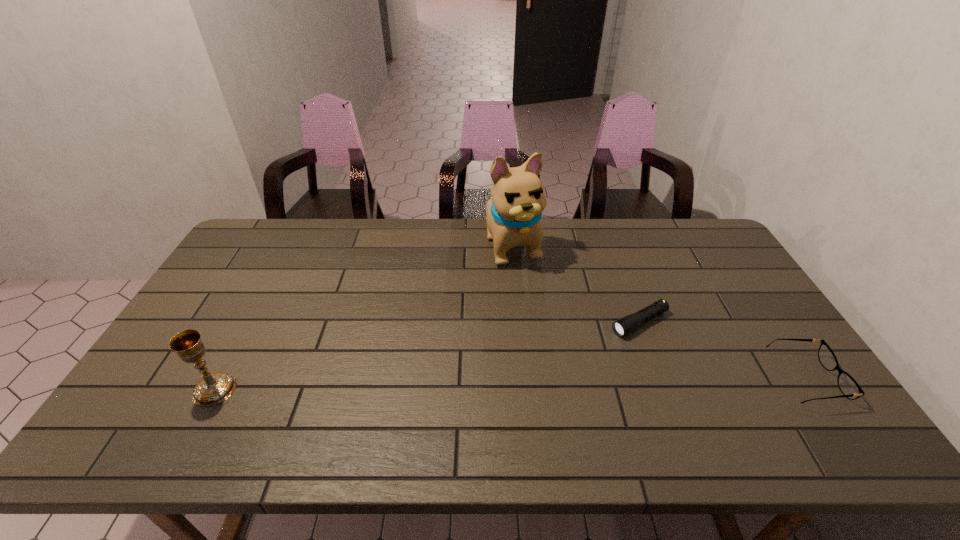
Where is `vacant space situated 0.240m at the lens end of the second object from right to left`? The image size is (960, 540). vacant space situated 0.240m at the lens end of the second object from right to left is located at coordinates (549, 368).

At what (x,y) coordinates should I click in order to perform the action: click on vacant space located at the lens end of the second object from right to left. Please return your answer as a coordinate pair (x, y). The height and width of the screenshot is (540, 960). Looking at the image, I should click on (603, 339).

At what (x,y) coordinates should I click in order to perform the action: click on vacant area located on the face of the puppy. Please return your answer as a coordinate pair (x, y). This screenshot has width=960, height=540. Looking at the image, I should click on (568, 357).

You are a GUI agent. You are given a task and a screenshot of the screen. Output one action in this format:
    pyautogui.click(x=<x>, y=<y>)
    Task: Click on the free space located 0.120m on the face of the puppy
    Image resolution: width=960 pixels, height=540 pixels.
    Given the screenshot: What is the action you would take?
    pyautogui.click(x=536, y=295)

I want to click on vacant area situated 0.080m on the face of the puppy, so click(532, 287).

Locate an element on the screen. The image size is (960, 540). object present at the far edge is located at coordinates (513, 213).

Where is `chalice located at the near edge`? This screenshot has width=960, height=540. chalice located at the near edge is located at coordinates (213, 389).

Where is `spectacles at the near edge`? spectacles at the near edge is located at coordinates (849, 387).

Where is `object that is positioned at the left edge`? object that is positioned at the left edge is located at coordinates (213, 389).

At what (x,y) coordinates should I click in order to perform the action: click on object that is at the right edge. Please return your answer as a coordinate pair (x, y). Looking at the image, I should click on (849, 387).